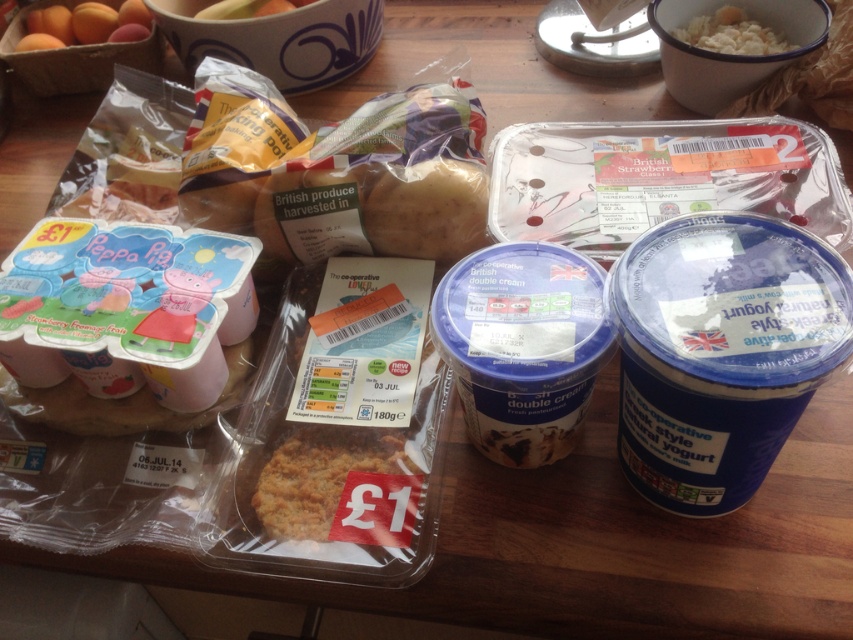
Between blue matte yogurt at lower right and smooth orange fruit at upper left, which one is positioned lower?

blue matte yogurt at lower right is lower down.

Between blue matte yogurt at lower right and smooth orange fruit at upper left, which one has less height?

smooth orange fruit at upper left is shorter.

Does point (722, 225) come closer to viewer compared to point (107, 13)?

Yes, it is.

You are a GUI agent. You are given a task and a screenshot of the screen. Output one action in this format:
    pyautogui.click(x=<x>, y=<y>)
    Task: Click on the blue matte yogurt at lower right
    
    Given the screenshot: What is the action you would take?
    pyautogui.click(x=720, y=352)

Consider the image. Is white creamy rice at upper right positioned before matte plastic bowl at upper center?

Yes, it is.

Is white creamy rice at upper right to the right of matte plastic bowl at upper center from the viewer's perspective?

Indeed, white creamy rice at upper right is positioned on the right side of matte plastic bowl at upper center.

Does point (706, 26) come in front of point (305, 1)?

Yes, it is in front of point (305, 1).

The width and height of the screenshot is (853, 640). Identify the location of white creamy rice at upper right. (730, 33).

Is blue matte yogurt at center positioned behind smooth brown potato at center?

No.

Who is more distant from viewer, (468, 435) or (445, 241)?

Positioned behind is point (445, 241).

This screenshot has width=853, height=640. I want to click on blue matte yogurt at center, so click(521, 346).